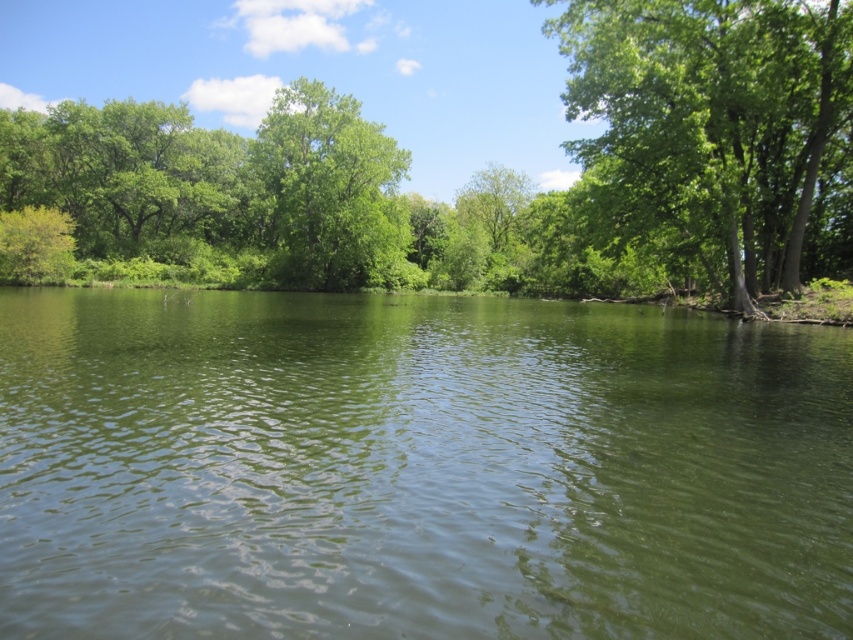
Question: Which of these objects is positioned farthest from the green leafy tree at center?

Choices:
 (A) green leafy tree at right
 (B) green smooth water at center

Answer: (B)

Question: Where is green smooth water at center located in relation to green leafy tree at right in the image?

Choices:
 (A) right
 (B) left

Answer: (B)

Question: Where is green smooth water at center located in relation to green leafy tree at center in the image?

Choices:
 (A) above
 (B) below

Answer: (B)

Question: Based on their relative distances, which object is farther from the green leafy tree at center?

Choices:
 (A) green smooth water at center
 (B) green leafy tree at right

Answer: (A)

Question: Which of these objects is positioned farthest from the green leafy tree at right?

Choices:
 (A) green smooth water at center
 (B) green leafy tree at center

Answer: (B)

Question: Does green leafy tree at right have a lesser width compared to green leafy tree at center?

Choices:
 (A) no
 (B) yes

Answer: (A)